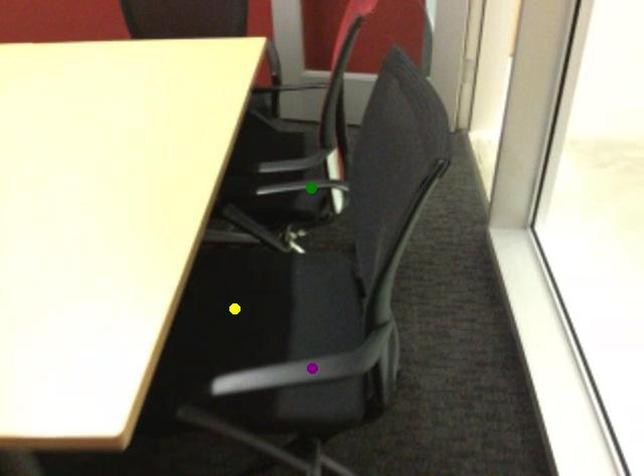
Order these from nearest to farthest:
1. green point
2. purple point
3. yellow point

purple point → yellow point → green point